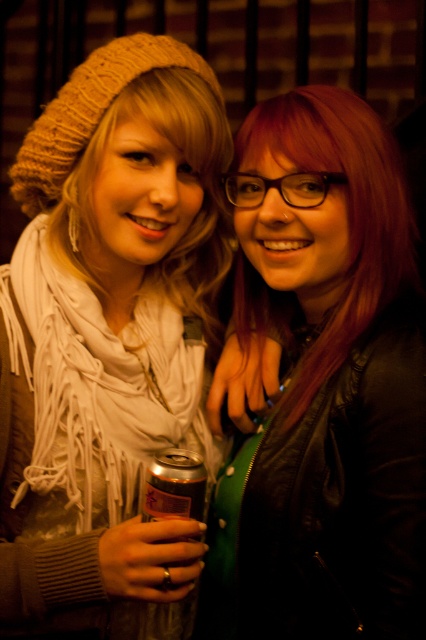
You are taking a photo of two people standing at the point labeled as point (385, 237). If you want to ensure both individuals are in focus, what is the minimum distance you need to be from the camera to capture them clearly?

The point labeled as point (385, 237) and the camera are 3.59 feet apart, so you need to be at least 3.59 feet away from the camera to ensure both individuals are in focus.

You are taking a photo of two people standing in front of you. You notice two points in the image labeled as point (115, 348) and point (172, 497). Which point is closer to your camera?

Point (115, 348) is closer to the camera than point (172, 497) because it is further to the camera.

You are a photographer standing 5 feet away from the knitted beige beanie at upper left. Can you reach it without moving your position?

The knitted beige beanie at upper left is 36.33 inches from the viewer. Since 36.33 inches is approximately 3.03 feet, and the photographer is standing 5 feet away, the distance is greater than the reach of an average person, so the photographer cannot reach it without moving.